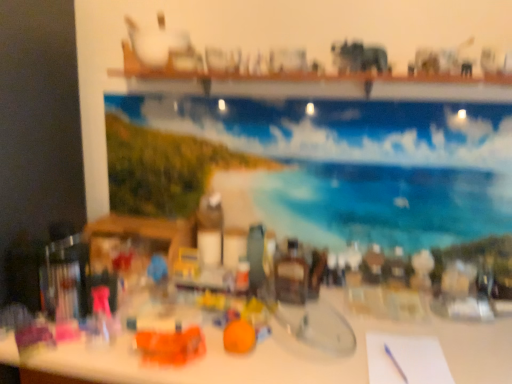
At what (x,y) coordinates should I click in order to perform the action: click on vacant space in between orange plastic toy at center, placed as the first toy when sorted from left to right, and orange matte toy at center, which is counted as the first toy, starting from the right. Please return your answer as a coordinate pair (x, y). This screenshot has height=384, width=512. Looking at the image, I should click on (221, 364).